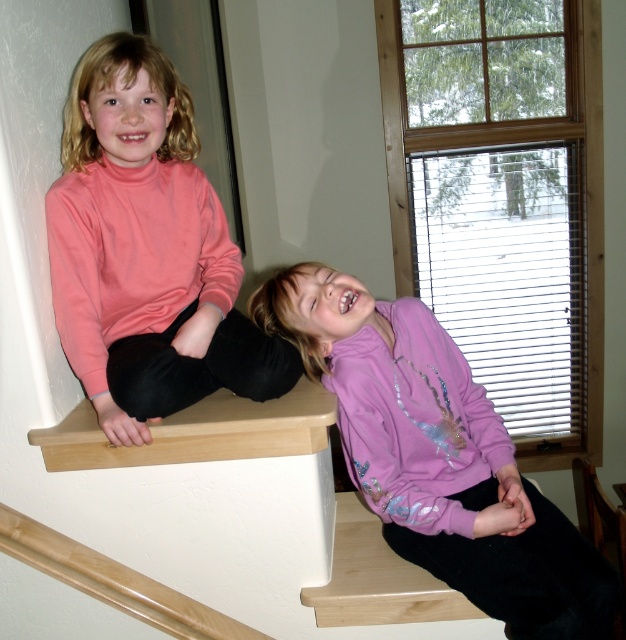
Is pink turtleneck sweater at upper left to the left of purple fleece jacket at upper right from the viewer's perspective?

Correct, you'll find pink turtleneck sweater at upper left to the left of purple fleece jacket at upper right.

Between point (121, 92) and point (423, 308), which one is positioned behind?

Point (423, 308)

The height and width of the screenshot is (640, 626). Identify the location of pink turtleneck sweater at upper left. (146, 250).